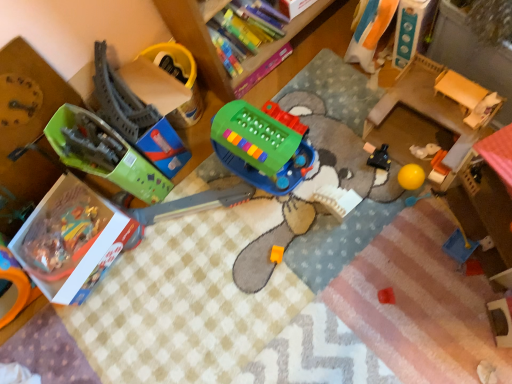
In order to click on free location to the left of black plastic toy at center-right, which is the 5th toy in left-to-right order in this screenshot , I will do `click(338, 188)`.